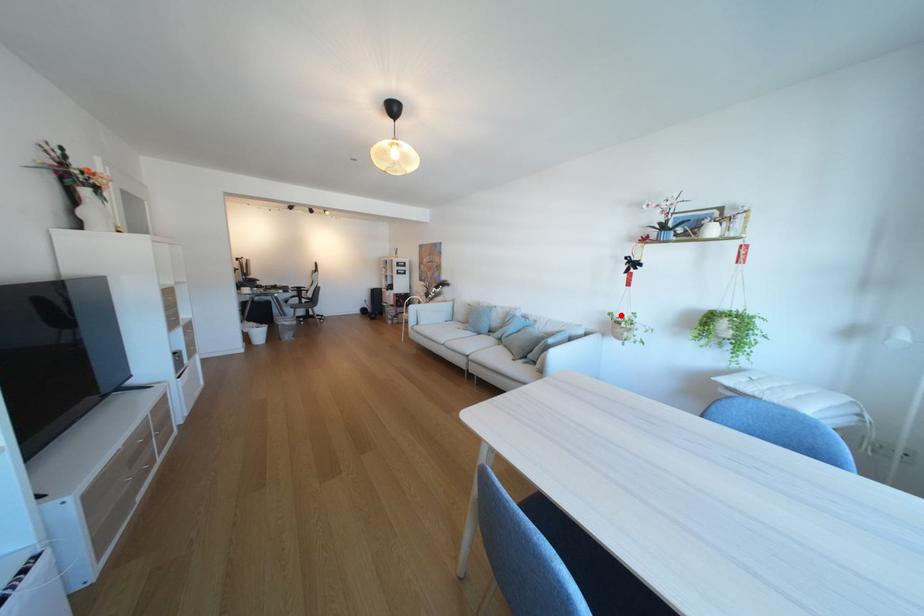
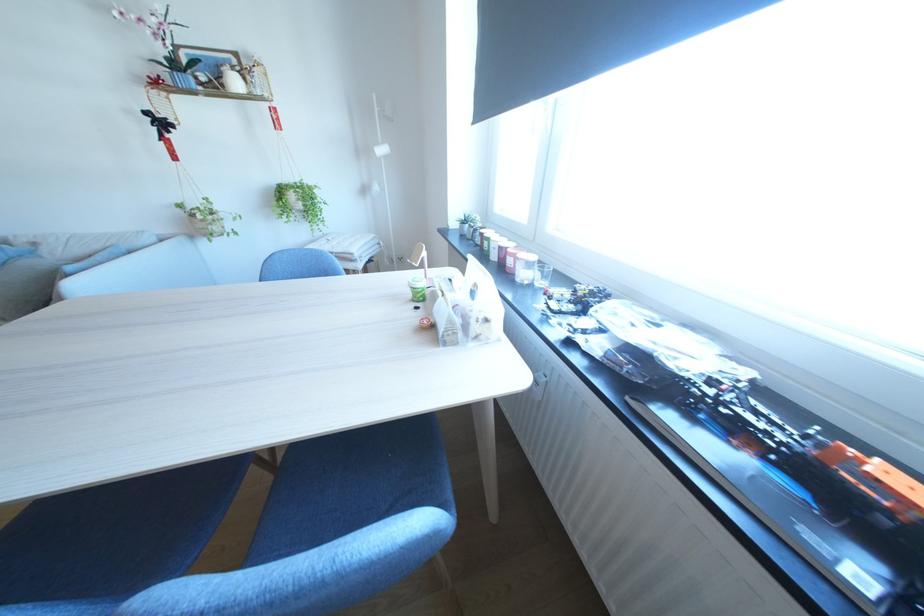
Where in the second image is the point corresponding to the highlighted location from the first image?

(190, 207)